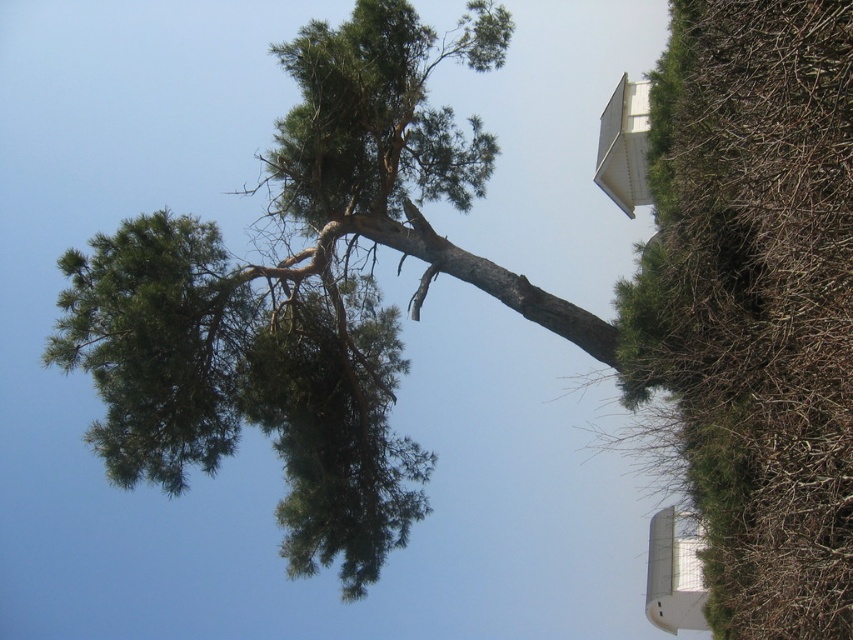
Is point (143, 275) farther from viewer compared to point (171, 365)?

No.

Is point (312, 472) positioned after point (114, 314)?

Yes.

Image resolution: width=853 pixels, height=640 pixels. Identify the location of green rough bark tree at upper left. (305, 296).